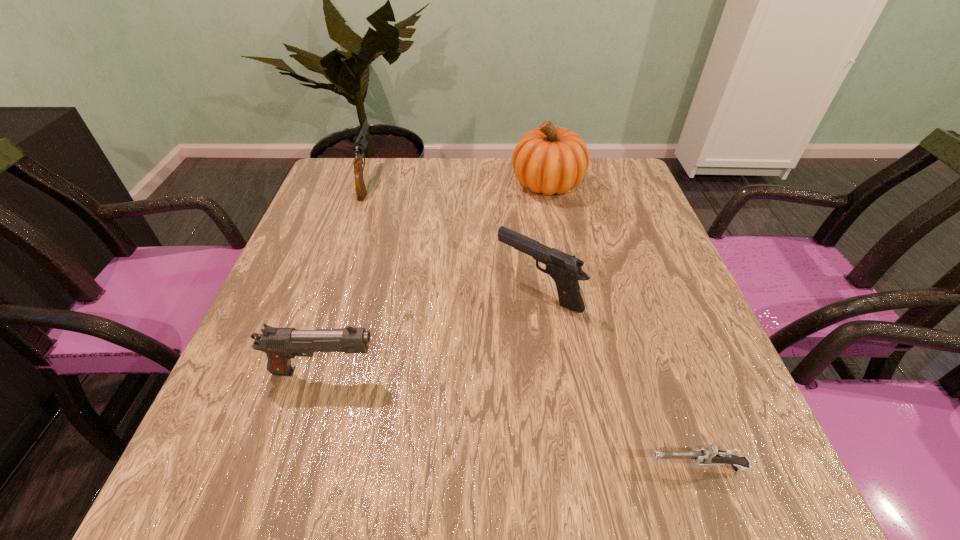
Find the location of a particular element. The width and height of the screenshot is (960, 540). object located in the far left corner section of the desktop is located at coordinates (360, 145).

Locate an element on the screen. Image resolution: width=960 pixels, height=540 pixels. object that is at the far right corner is located at coordinates (549, 160).

Locate an element on the screen. object that is at the near right corner is located at coordinates [710, 455].

The image size is (960, 540). In the image, there is a desktop. What are the coordinates of `free space at the far edge` in the screenshot? It's located at (393, 183).

In the image, there is a desktop. In order to click on vacant area at the near edge in this screenshot , I will do `click(434, 487)`.

Locate an element on the screen. Image resolution: width=960 pixels, height=540 pixels. free space at the left edge of the desktop is located at coordinates (312, 307).

You are a GUI agent. You are given a task and a screenshot of the screen. Output one action in this format:
    pyautogui.click(x=<x>, y=<y>)
    Task: Click on the vacant region at the right edge of the desktop
    The image size is (960, 540).
    Given the screenshot: What is the action you would take?
    pyautogui.click(x=653, y=369)

You are a GUI agent. You are given a task and a screenshot of the screen. Output one action in this format:
    pyautogui.click(x=<x>, y=<y>)
    Task: Click on the vacant area at the far left corner of the desktop
    This screenshot has width=960, height=540.
    Given the screenshot: What is the action you would take?
    pyautogui.click(x=335, y=164)

Where is `blank space at the far right corner of the desktop`? The image size is (960, 540). blank space at the far right corner of the desktop is located at coordinates (612, 164).

You are a GUI agent. You are given a task and a screenshot of the screen. Output one action in this format:
    pyautogui.click(x=<x>, y=<y>)
    Task: Click on the vacant position at the near right corner of the desktop
    The image size is (960, 540).
    Given the screenshot: What is the action you would take?
    pyautogui.click(x=703, y=483)